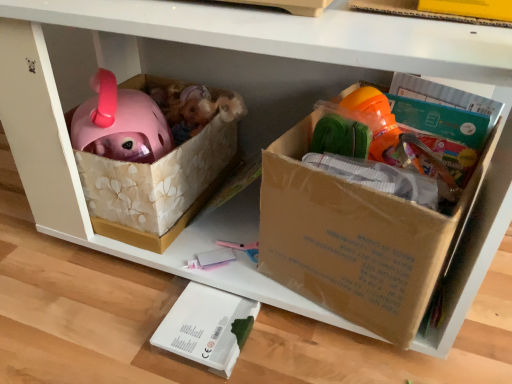
Question: Is brown cardboard box at center bigger or smaller than white matte box at lower center?

Choices:
 (A) small
 (B) big

Answer: (B)

Question: Is brown cardboard box at center to the left or to the right of white matte box at lower center in the image?

Choices:
 (A) right
 (B) left

Answer: (A)

Question: In the image, is brown cardboard box at center positioned in front of or behind white matte box at lower center?

Choices:
 (A) behind
 (B) front

Answer: (B)

Question: Choose the correct answer: Is white matte box at lower center inside brown cardboard box at center or outside it?

Choices:
 (A) outside
 (B) inside

Answer: (A)

Question: Is point click(x=217, y=322) positioned closer to the camera than point click(x=352, y=221)?

Choices:
 (A) farther
 (B) closer

Answer: (A)

Question: From a real-world perspective, is white matte box at lower center positioned above or below brown cardboard box at center?

Choices:
 (A) below
 (B) above

Answer: (A)

Question: Considering the positions of white matte box at lower center and brown cardboard box at center in the image, is white matte box at lower center taller or shorter than brown cardboard box at center?

Choices:
 (A) short
 (B) tall

Answer: (A)